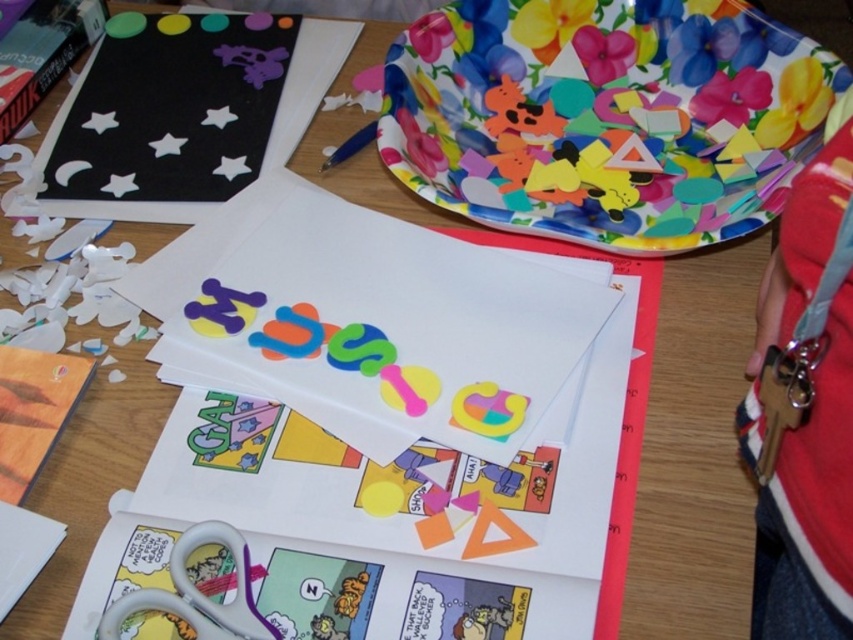
You are organizing a craft activity and need to arrange materials based on their height. You have a floral paper plate at upper right and a matte paper at center. Which one should you place on the higher shelf to match their actual heights?

The floral paper plate at upper right is taller than the matte paper at center, so you should place the floral paper plate at upper right on the higher shelf to match their actual heights.

You are organizing craft materials on the table. You have a floral paper plate at upper right and a matte paper at center. Which one is wider?

The matte paper at center is wider than the floral paper plate at upper right.